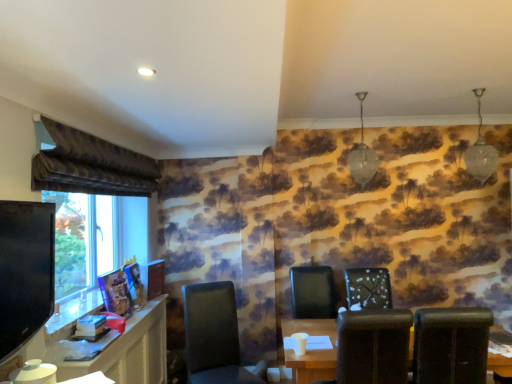
Question: Does point (224, 334) appear closer or farther from the camera than point (24, 329)?

Choices:
 (A) closer
 (B) farther

Answer: (B)

Question: From their relative heights in the image, would you say matte black chair at center, which ranks as the fourth chair in right-to-left order, is taller or shorter than black glossy tv at left?

Choices:
 (A) short
 (B) tall

Answer: (B)

Question: Which object is positioned farthest from the matte black chair at center, which ranks as the fourth chair in right-to-left order?

Choices:
 (A) matte black computer desk at lower left
 (B) white textured chair at center, the second chair viewed from the right
 (C) black leather chair at lower right, the 1th chair viewed from the right
 (D) black glossy tv at left
 (E) matte brown table at lower center

Answer: (D)

Question: Which object is the farthest from the black glossy tv at left?

Choices:
 (A) black leather chair at lower right, the 1th chair viewed from the right
 (B) matte brown table at lower center
 (C) brown leather chair at center, which is counted as the 3th chair, starting from the right
 (D) matte black chair at center, which is the 1th chair from left to right
 (E) velvet brown curtain at upper left

Answer: (A)